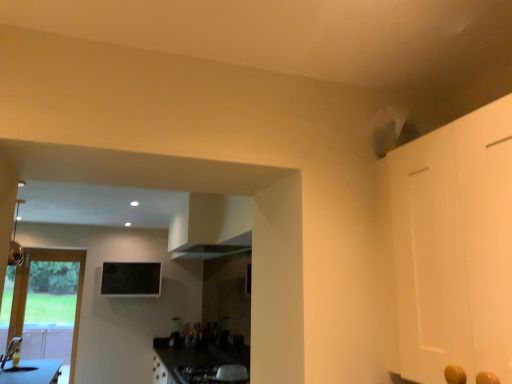
The image size is (512, 384). What do you see at coordinates (131, 279) in the screenshot? I see `black glass window screen at upper center` at bounding box center [131, 279].

Identify the location of metallic silver gas stove at lower center. Image resolution: width=512 pixels, height=384 pixels. (212, 374).

Is black glass window screen at upper center positioned far away from metallic silver gas stove at lower center?

black glass window screen at upper center is positioned a significant distance from metallic silver gas stove at lower center.

Can you tell me how much black glass window screen at upper center and metallic silver gas stove at lower center differ in facing direction?

There is a 82.1-degree angle between the facing directions of black glass window screen at upper center and metallic silver gas stove at lower center.

Which of these two, black glass window screen at upper center or metallic silver gas stove at lower center, is smaller?

With smaller size is metallic silver gas stove at lower center.

The image size is (512, 384). In order to click on window screen that appears above the metallic silver gas stove at lower center (from a real-world perspective) in this screenshot , I will do `click(131, 279)`.

Can you confirm if black glass window screen at upper center is positioned to the right of wooden door at left?

Indeed, black glass window screen at upper center is positioned on the right side of wooden door at left.

From the picture: Does black glass window screen at upper center have a lesser height compared to wooden door at left?

Indeed, black glass window screen at upper center has a lesser height compared to wooden door at left.

Identify the location of window screen positioned vertically above the wooden door at left (from a real-world perspective). (131, 279).

Is black glass window screen at upper center thinner than wooden door at left?

No.

Is metallic silver gas stove at lower center wider than black glass window screen at upper center?

Correct, the width of metallic silver gas stove at lower center exceeds that of black glass window screen at upper center.

Between metallic silver gas stove at lower center and black glass window screen at upper center, which one has less height?

With less height is metallic silver gas stove at lower center.

Would you say metallic silver gas stove at lower center is outside black glass window screen at upper center?

metallic silver gas stove at lower center lies outside black glass window screen at upper center's area.

Image resolution: width=512 pixels, height=384 pixels. What are the coordinates of `gas stove in front of the black glass window screen at upper center` in the screenshot? It's located at (212, 374).

From the image's perspective, is metallic silver gas stove at lower center under wooden door at left?

Actually, metallic silver gas stove at lower center appears above wooden door at left in the image.

Which object is thinner, metallic silver gas stove at lower center or wooden door at left?

With smaller width is wooden door at left.

The width and height of the screenshot is (512, 384). In order to click on gas stove directly beneath the wooden door at left (from a real-world perspective) in this screenshot , I will do `click(212, 374)`.

Is point (178, 366) closer or farther from the camera than point (27, 270)?

Clearly, point (178, 366) is closer to the camera than point (27, 270).

In terms of width, does wooden door at left look wider or thinner when compared to metallic silver gas stove at lower center?

Considering their sizes, wooden door at left looks slimmer than metallic silver gas stove at lower center.

This screenshot has width=512, height=384. I want to click on gas stove that is above the wooden door at left (from the image's perspective), so click(212, 374).

From the image's perspective, is wooden door at left on metallic silver gas stove at lower center?

No, from the image's perspective, wooden door at left is not on top of metallic silver gas stove at lower center.

Between wooden door at left and metallic silver gas stove at lower center, which one is positioned in front?

metallic silver gas stove at lower center is in front.

Consider the image. Which is behind, wooden door at left or black glass window screen at upper center?

black glass window screen at upper center is more distant.

Which point is more forward, (77, 305) or (119, 290)?

Positioned in front is point (77, 305).

Is wooden door at left touching black glass window screen at upper center?

wooden door at left and black glass window screen at upper center are clearly separated.

Find the location of a particular element. The image size is (512, 384). window screen behind the wooden door at left is located at coordinates (131, 279).

Locate an element on the screen. The image size is (512, 384). gas stove in front of the black glass window screen at upper center is located at coordinates (212, 374).

The image size is (512, 384). I want to click on window screen above the wooden door at left (from a real-world perspective), so click(x=131, y=279).

Based on the photo, which object lies nearer to the anchor point wooden door at left, black glass window screen at upper center or metallic silver gas stove at lower center?

Among the two, black glass window screen at upper center is located nearer to wooden door at left.

Considering their positions, is metallic silver gas stove at lower center positioned further to wooden door at left than black glass window screen at upper center?

metallic silver gas stove at lower center lies further to wooden door at left than the other object.

Looking at the image, which one is located closer to metallic silver gas stove at lower center, wooden door at left or black glass window screen at upper center?

black glass window screen at upper center lies closer to metallic silver gas stove at lower center than the other object.

Looking at the image, which one is located closer to metallic silver gas stove at lower center, black glass window screen at upper center or wooden door at left?

black glass window screen at upper center.

When comparing their distances from black glass window screen at upper center, does wooden door at left or metallic silver gas stove at lower center seem further?

metallic silver gas stove at lower center is positioned further to the anchor black glass window screen at upper center.

From the image, which object appears to be farther from black glass window screen at upper center, metallic silver gas stove at lower center or wooden door at left?

metallic silver gas stove at lower center.

The width and height of the screenshot is (512, 384). What are the coordinates of `door between metallic silver gas stove at lower center and black glass window screen at upper center in the front-back direction` in the screenshot? It's located at (45, 306).